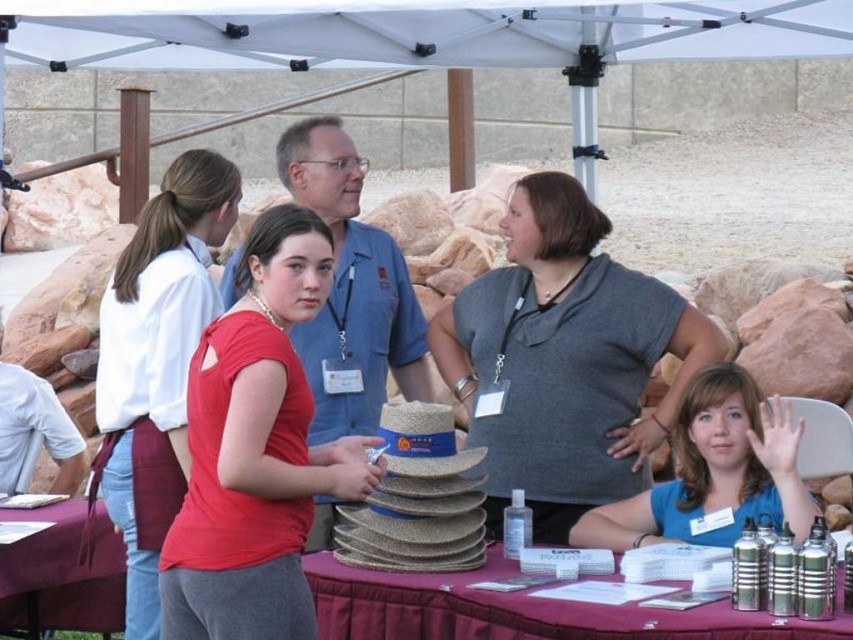
Is metallic silver water bottles at lower right to the right of maroon fabric table at lower left from the viewer's perspective?

Indeed, metallic silver water bottles at lower right is positioned on the right side of maroon fabric table at lower left.

Is metallic silver water bottles at lower right below maroon fabric table at lower left?

No, metallic silver water bottles at lower right is not below maroon fabric table at lower left.

Consider the image. Who is more forward, [480,612] or [44,544]?

Point [480,612] is more forward.

This screenshot has height=640, width=853. I want to click on metallic silver water bottles at lower right, so click(517, 611).

Between point (587, 385) and point (512, 620), which one is positioned behind?

The point (587, 385) is more distant.

Does gray matte shirt at center have a larger size compared to metallic silver water bottles at lower right?

Yes, gray matte shirt at center is bigger than metallic silver water bottles at lower right.

Between point (590, 374) and point (358, 616), which one is positioned behind?

Positioned behind is point (590, 374).

Identify the location of gray matte shirt at center. The height and width of the screenshot is (640, 853). (564, 358).

Can you confirm if matte red shirt at center is taller than maroon fabric table at lower left?

Indeed, matte red shirt at center has a greater height compared to maroon fabric table at lower left.

Which of these two, matte red shirt at center or maroon fabric table at lower left, stands taller?

Standing taller between the two is matte red shirt at center.

Which is behind, point (202, 314) or point (67, 579)?

The point (67, 579) is more distant.

This screenshot has width=853, height=640. In order to click on matte red shirt at center in this screenshot , I will do `click(155, 365)`.